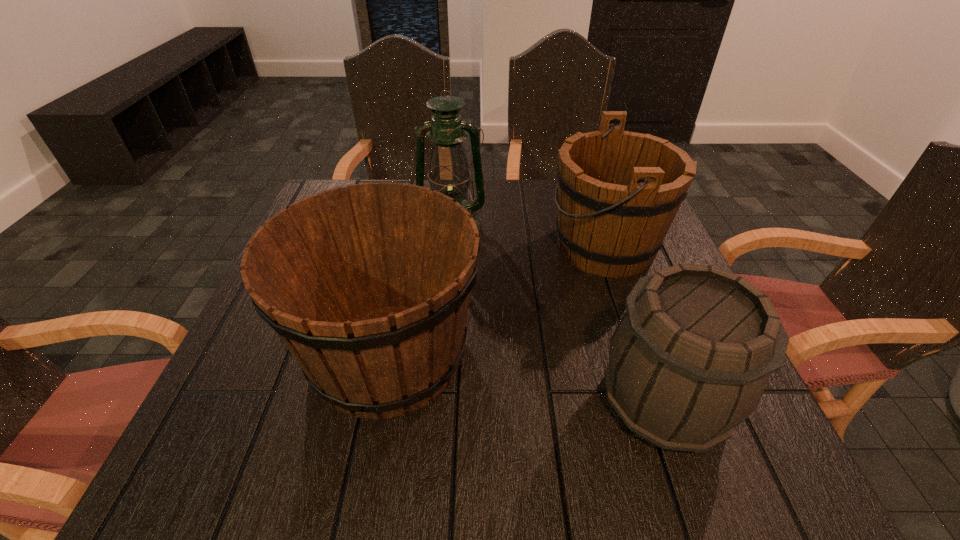
You are a GUI agent. You are given a task and a screenshot of the screen. Output one action in this format:
    pyautogui.click(x=<x>, y=<y>)
    Task: Click on the object at the left edge
    Image resolution: width=960 pixels, height=540 pixels.
    Given the screenshot: What is the action you would take?
    pyautogui.click(x=368, y=286)

At what (x,y) coordinates should I click in order to perform the action: click on object located in the near left corner section of the desktop. Please return your answer as a coordinate pair (x, y). This screenshot has height=540, width=960. Looking at the image, I should click on (x=368, y=286).

What are the coordinates of `object positioned at the far right corner` in the screenshot? It's located at (618, 191).

The width and height of the screenshot is (960, 540). I want to click on object that is positioned at the near right corner, so click(690, 359).

I want to click on vacant point at the far edge, so click(548, 184).

You are a GUI agent. You are given a task and a screenshot of the screen. Output one action in this format:
    pyautogui.click(x=<x>, y=<y>)
    Task: Click on the vacant area at the near edge
    The width and height of the screenshot is (960, 540).
    Given the screenshot: What is the action you would take?
    pyautogui.click(x=362, y=465)

Find the location of a particular element. This screenshot has height=540, width=960. free region at the left edge of the desktop is located at coordinates (291, 407).

Locate an element on the screen. Image resolution: width=960 pixels, height=540 pixels. vacant space at the right edge of the desktop is located at coordinates (627, 294).

The height and width of the screenshot is (540, 960). What are the coordinates of `free location at the far left corner` in the screenshot? It's located at [318, 192].

This screenshot has width=960, height=540. I want to click on vacant space at the near left corner, so (284, 436).